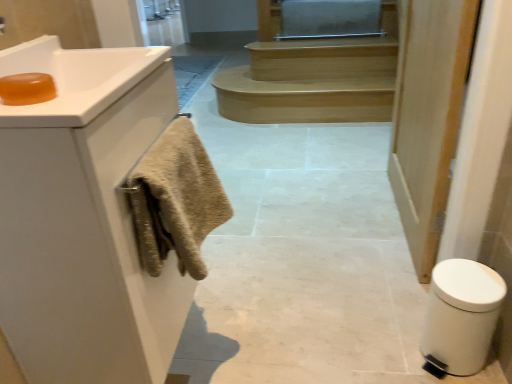
Question: From a real-world perspective, is white matte door at right physically below white matte cabinet at left?

Choices:
 (A) yes
 (B) no

Answer: (B)

Question: Considering the relative sizes of white matte door at right and white matte cabinet at left in the image provided, is white matte door at right taller than white matte cabinet at left?

Choices:
 (A) no
 (B) yes

Answer: (B)

Question: From the image's perspective, is white matte door at right below white matte cabinet at left?

Choices:
 (A) yes
 (B) no

Answer: (B)

Question: Is white matte door at right shorter than white matte cabinet at left?

Choices:
 (A) yes
 (B) no

Answer: (B)

Question: Can you confirm if white matte door at right is bigger than white matte cabinet at left?

Choices:
 (A) yes
 (B) no

Answer: (B)

Question: From a real-world perspective, is white matte door at right on white matte cabinet at left?

Choices:
 (A) yes
 (B) no

Answer: (A)

Question: Is white matte cabinet at left oriented towards translucent amber soap at upper left?

Choices:
 (A) no
 (B) yes

Answer: (A)

Question: Does white matte cabinet at left lie behind translucent amber soap at upper left?

Choices:
 (A) yes
 (B) no

Answer: (B)

Question: Considering the relative sizes of white matte cabinet at left and translucent amber soap at upper left in the image provided, is white matte cabinet at left taller than translucent amber soap at upper left?

Choices:
 (A) no
 (B) yes

Answer: (B)

Question: Is translucent amber soap at upper left completely or partially inside white matte cabinet at left?

Choices:
 (A) yes
 (B) no

Answer: (B)

Question: From the image's perspective, would you say white matte cabinet at left is shown under translucent amber soap at upper left?

Choices:
 (A) no
 (B) yes

Answer: (B)

Question: Is white matte cabinet at left smaller than translucent amber soap at upper left?

Choices:
 (A) yes
 (B) no

Answer: (B)

Question: Does beige textured towel at left have a larger size compared to white matte door at right?

Choices:
 (A) no
 (B) yes

Answer: (A)